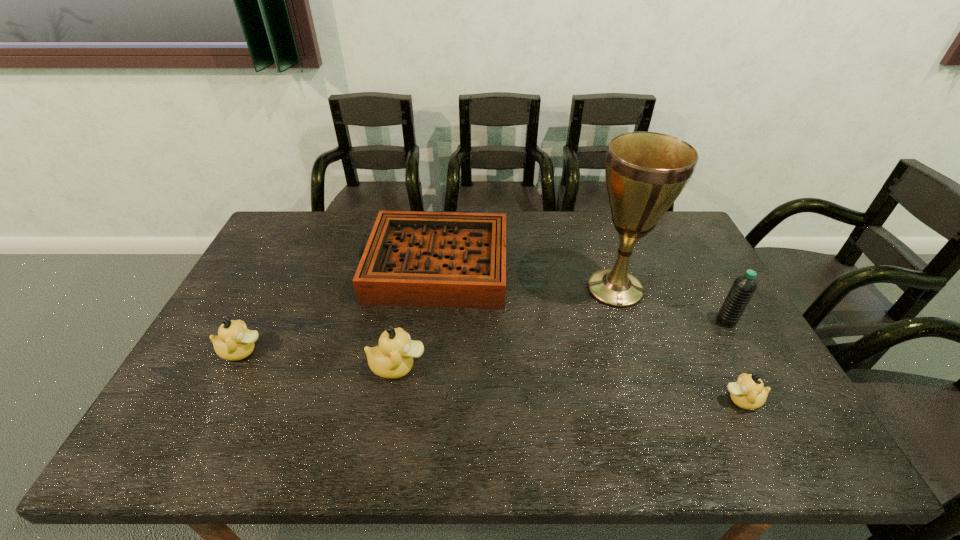
Locate an element on the screen. The image size is (960, 540). trophy cup is located at coordinates (645, 172).

This screenshot has height=540, width=960. In order to click on vacant space located on the face of the fourth tallest object in this screenshot , I will do (295, 352).

At what (x,y) coordinates should I click in order to perform the action: click on free space located 0.080m on the face of the third tallest object. Please return your answer as a coordinate pair (x, y). The height and width of the screenshot is (540, 960). Looking at the image, I should click on (457, 367).

Identify the location of vacant region located on the face of the shortest duckling. The width and height of the screenshot is (960, 540). (618, 400).

Where is `vacant area situated on the face of the shortest duckling`? vacant area situated on the face of the shortest duckling is located at coordinates (656, 400).

This screenshot has width=960, height=540. I want to click on vacant region located on the face of the shortest duckling, so click(651, 400).

Find the location of `blank area located on the front of the water bottle`. blank area located on the front of the water bottle is located at coordinates (737, 342).

Find the location of a particular element. Image resolution: width=960 pixels, height=540 pixels. vacant space situated 0.360m on the left of the gameboard is located at coordinates (253, 265).

This screenshot has height=540, width=960. Find the location of `vacant area situated 0.170m on the left of the tallest object`. vacant area situated 0.170m on the left of the tallest object is located at coordinates click(x=526, y=289).

Locate an element on the screen. This screenshot has width=960, height=540. object that is at the far edge is located at coordinates (419, 259).